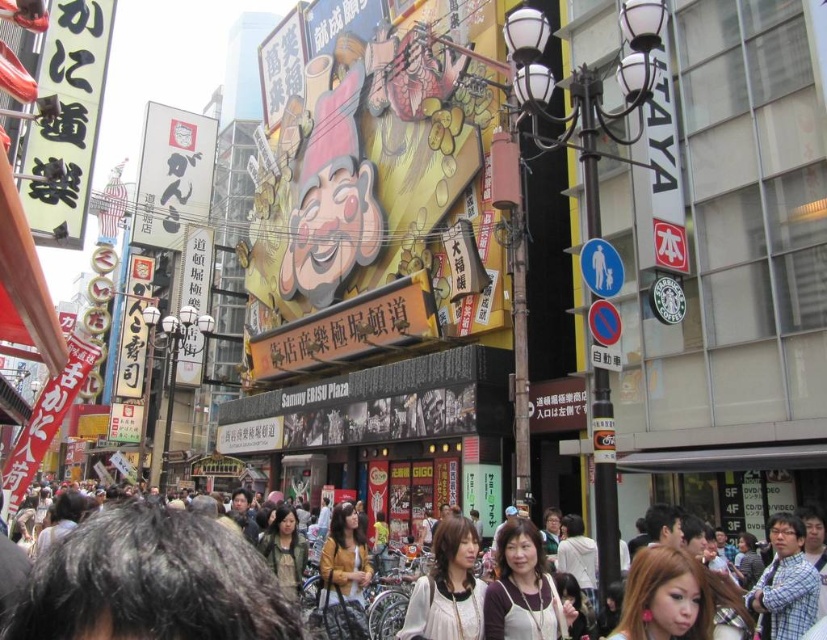
Does matte brown hair at center have a smaller size compared to matte white blouse at center?

Yes.

Does point (520, 532) come in front of point (462, 563)?

No.

Describe the element at coordinates (523, 589) in the screenshot. I see `matte brown hair at center` at that location.

This screenshot has width=827, height=640. Identify the location of matte brown hair at center. (523, 589).

Does matte white blouse at center appear on the left side of plaid shirt at lower right?

Yes, matte white blouse at center is to the left of plaid shirt at lower right.

Who is more distant from viewer, (472, 618) or (796, 580)?

The point (472, 618) is more distant.

Identify the location of matte white blouse at center. The height and width of the screenshot is (640, 827). click(x=447, y=588).

Which of these two, multicolored clothing at center or matte white blouse at center, stands taller?

matte white blouse at center is taller.

Can you confirm if multicolored clothing at center is positioned below matte white blouse at center?

No, multicolored clothing at center is not below matte white blouse at center.

Who is more distant from viewer, (x=25, y=563) or (x=405, y=616)?

Positioned behind is point (x=405, y=616).

You are a GUI agent. You are given a task and a screenshot of the screen. Output one action in this format:
    pyautogui.click(x=<x>, y=<y>)
    Task: Click on the multicolored clothing at center
    The width and height of the screenshot is (827, 640).
    Given the screenshot: What is the action you would take?
    pyautogui.click(x=151, y=582)